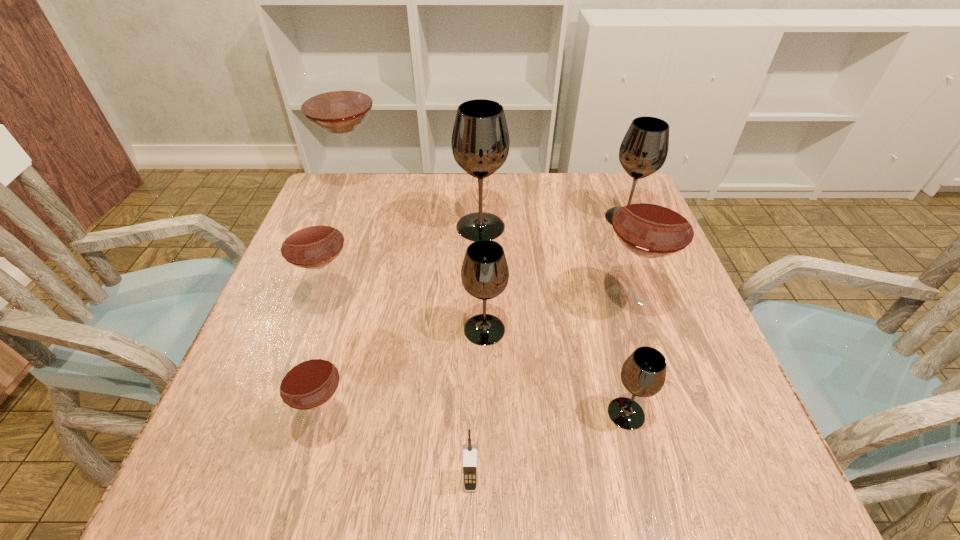
Locate an element on the screen. The width and height of the screenshot is (960, 540). object located at the far left corner is located at coordinates (336, 99).

Locate an element on the screen. object at the near left corner is located at coordinates (306, 379).

Where is `object that is at the far right corner`? object that is at the far right corner is located at coordinates (644, 148).

The image size is (960, 540). I want to click on vacant position at the far edge of the desktop, so click(433, 181).

Locate an element on the screen. The width and height of the screenshot is (960, 540). vacant space at the near edge is located at coordinates point(657,476).

Image resolution: width=960 pixels, height=540 pixels. In the image, there is a desktop. In order to click on free space at the left edge in this screenshot , I will do `click(287, 266)`.

Locate an element on the screen. This screenshot has height=540, width=960. free spot at the right edge of the desktop is located at coordinates click(627, 282).

Locate an element on the screen. This screenshot has height=540, width=960. free point at the far left corner is located at coordinates coord(380,182).

In the image, there is a desktop. What are the coordinates of `free space at the near right corner` in the screenshot? It's located at (713, 480).

Where is `free spot between the biggest red wineglass and the third gray wineglass from left to right`? The image size is (960, 540). free spot between the biggest red wineglass and the third gray wineglass from left to right is located at coordinates (492, 301).